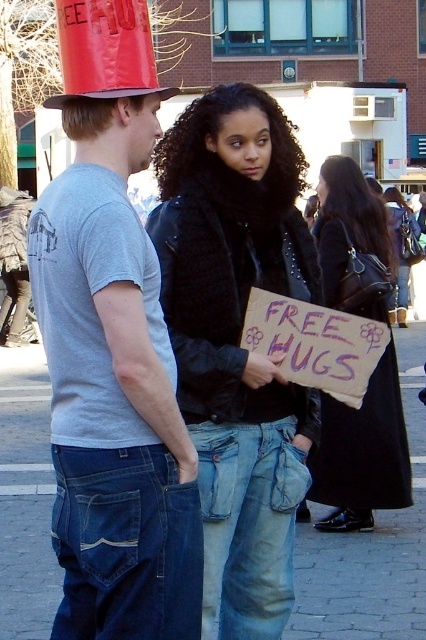
Question: Is matte gray t-shirt at left positioned at the back of shiny red paper hat at upper left?

Choices:
 (A) no
 (B) yes

Answer: (A)

Question: Which of the following is the farthest from the observer?

Choices:
 (A) (198, 538)
 (B) (95, 16)
 (C) (26, 464)
 (D) (319, 294)

Answer: (C)

Question: Among these objects, which one is farthest from the camera?

Choices:
 (A) matte gray t-shirt at left
 (B) shiny red paper hat at upper left
 (C) black leather coat at center

Answer: (C)

Question: Which point is farther to the camera?

Choices:
 (A) shiny red paper hat at upper left
 (B) matte gray t-shirt at left
 (C) blue jeans at center
 (D) black leather coat at center

Answer: (D)

Question: Does leather jacket at center appear over blue jeans at center?

Choices:
 (A) no
 (B) yes

Answer: (B)

Question: Is matte gray t-shirt at left above shiny red paper hat at upper left?

Choices:
 (A) no
 (B) yes

Answer: (A)